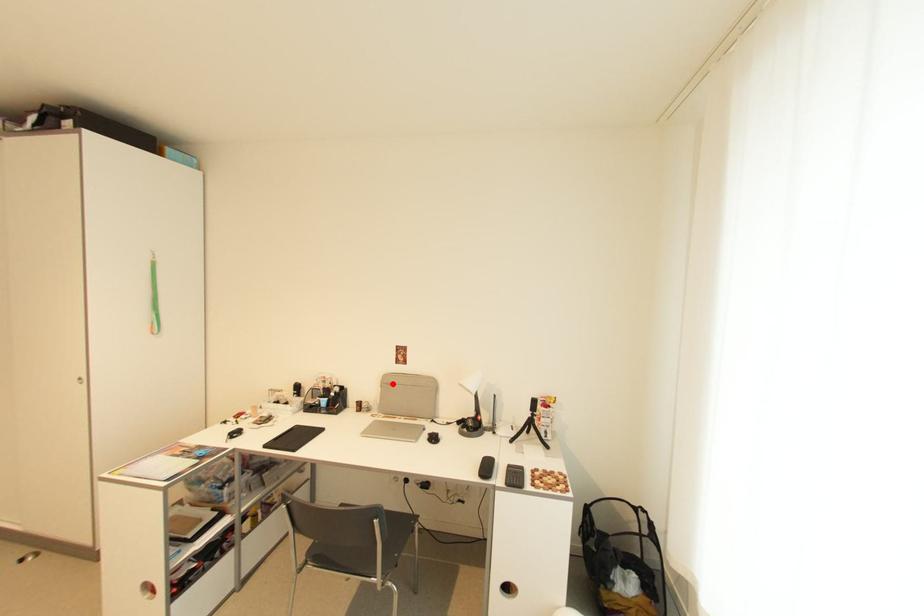
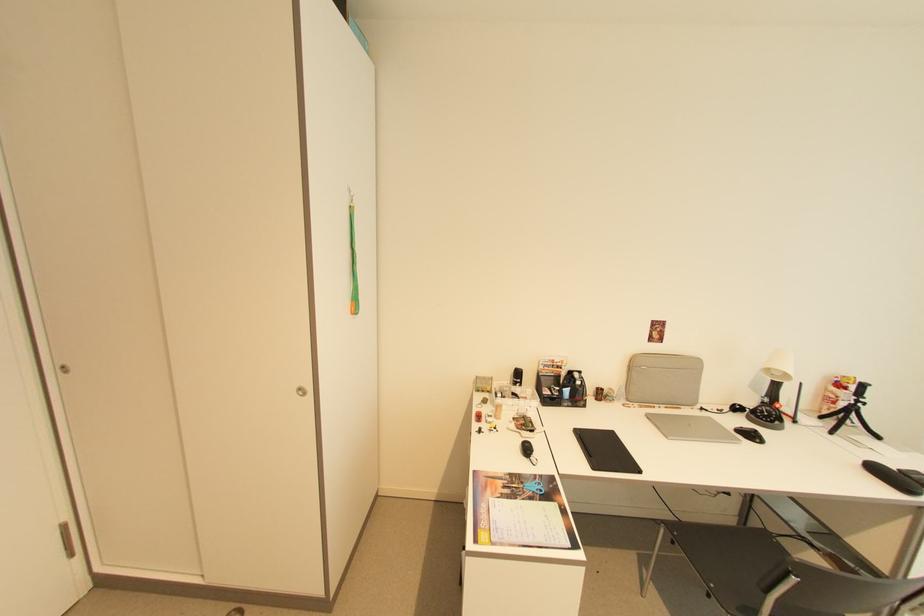
Question: I am providing you with two images of the same scene from different viewpoints. In image1, a red point is highlighted. Considering the same 3D point in image2, which of the following is correct?

Choices:
 (A) It is closer
 (B) It is farther

Answer: (A)